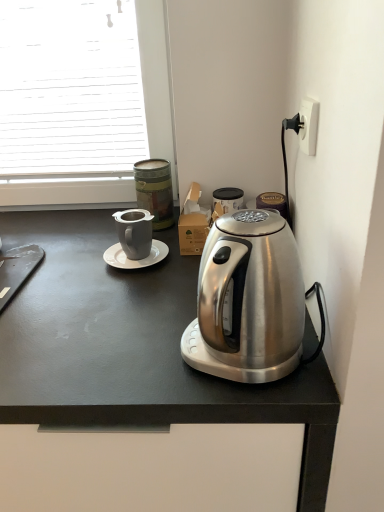
Image resolution: width=384 pixels, height=512 pixels. Find the location of `free space to the left of matte gray mug at upper center`. free space to the left of matte gray mug at upper center is located at coordinates (81, 237).